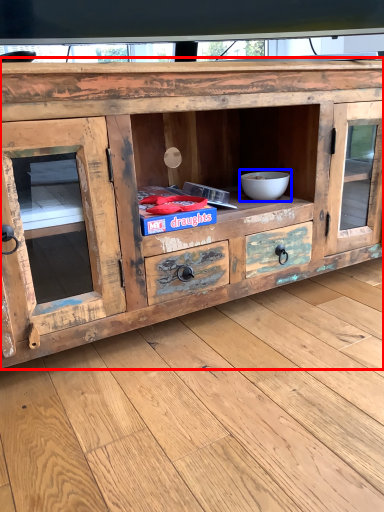
Question: Among these objects, which one is nearest to the camera, chest of drawers (highlighted by a red box) or bowl (highlighted by a blue box)?

Choices:
 (A) chest of drawers
 (B) bowl

Answer: (A)